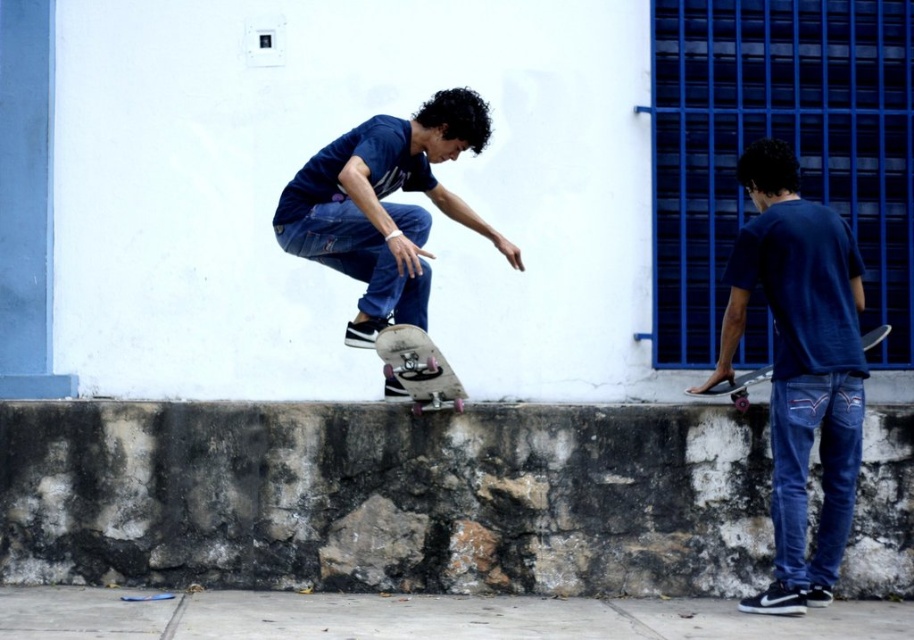
Between matte blue shirt at center and matte black skateboard at right, which one appears on the right side from the viewer's perspective?

Positioned to the right is matte black skateboard at right.

Can you confirm if matte blue shirt at center is taller than matte black skateboard at right?

Yes, matte blue shirt at center is taller than matte black skateboard at right.

You are a GUI agent. You are given a task and a screenshot of the screen. Output one action in this format:
    pyautogui.click(x=<x>, y=<y>)
    Task: Click on the matte blue shirt at center
    
    Given the screenshot: What is the action you would take?
    pyautogui.click(x=384, y=205)

At what (x,y) coordinates should I click in order to perform the action: click on matte blue shirt at center. Please return your answer as a coordinate pair (x, y). The image size is (914, 640). Looking at the image, I should click on (384, 205).

Between point (388, 368) and point (771, 368), which one is positioned in front?

Point (388, 368) is in front.

Is point (448, 378) positioned behind point (735, 401)?

No, (448, 378) is in front of (735, 401).

Who is more distant from viewer, (430, 374) or (767, 372)?

The point (767, 372) is more distant.

I want to click on white glossy skateboard at center, so click(x=418, y=369).

Does blue denim jeans at lower right appear on the right side of matte black skateboard at right?

Correct, you'll find blue denim jeans at lower right to the right of matte black skateboard at right.

Does point (751, 260) come behind point (735, 396)?

No, (751, 260) is in front of (735, 396).

Where is `blue denim jeans at lower right`? The width and height of the screenshot is (914, 640). blue denim jeans at lower right is located at coordinates (800, 365).